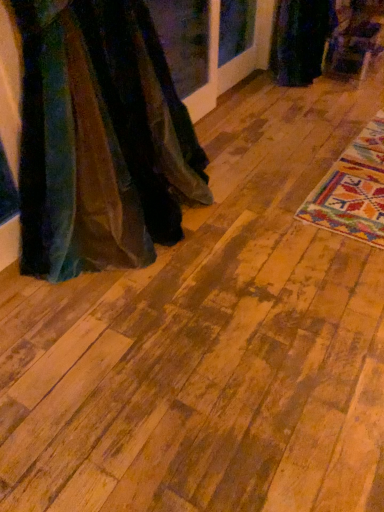
Question: Is velvet fabric dress at left, placed as the 1th fancy dress when sorted from left to right, placed right next to velvet dark green dress at upper right, the 1th fancy dress when ordered from right to left?

Choices:
 (A) yes
 (B) no

Answer: (B)

Question: From a real-world perspective, is velvet fabric dress at left, the first fancy dress viewed from the front, physically above velvet dark green dress at upper right, acting as the 2th fancy dress starting from the left?

Choices:
 (A) no
 (B) yes

Answer: (B)

Question: Does velvet fabric dress at left, the first fancy dress viewed from the front, appear on the right side of velvet dark green dress at upper right, acting as the 2th fancy dress starting from the left?

Choices:
 (A) yes
 (B) no

Answer: (B)

Question: Does velvet fabric dress at left, which appears as the 1th fancy dress when ordered from the bottom, have a greater width compared to velvet dark green dress at upper right, the 1th fancy dress when ordered from back to front?

Choices:
 (A) no
 (B) yes

Answer: (B)

Question: Can you confirm if velvet fabric dress at left, the second fancy dress when ordered from right to left, is positioned to the left of velvet dark green dress at upper right, the second fancy dress in the front-to-back sequence?

Choices:
 (A) no
 (B) yes

Answer: (B)

Question: Considering the relative sizes of velvet fabric dress at left, which is the 2th fancy dress in back-to-front order, and velvet dark green dress at upper right, the 1th fancy dress when ordered from back to front, in the image provided, is velvet fabric dress at left, which is the 2th fancy dress in back-to-front order, taller than velvet dark green dress at upper right, the 1th fancy dress when ordered from back to front,?

Choices:
 (A) yes
 (B) no

Answer: (A)

Question: Considering the relative sizes of velvet dark green dress at upper right, marked as the second fancy dress in a bottom-to-top arrangement, and wooden floor at center in the image provided, is velvet dark green dress at upper right, marked as the second fancy dress in a bottom-to-top arrangement, shorter than wooden floor at center?

Choices:
 (A) yes
 (B) no

Answer: (B)

Question: Does velvet dark green dress at upper right, the 1th fancy dress when ordered from back to front, have a greater width compared to wooden floor at center?

Choices:
 (A) no
 (B) yes

Answer: (A)

Question: Considering the relative sizes of velvet dark green dress at upper right, the 1th fancy dress when ordered from right to left, and wooden floor at center in the image provided, is velvet dark green dress at upper right, the 1th fancy dress when ordered from right to left, smaller than wooden floor at center?

Choices:
 (A) yes
 (B) no

Answer: (A)

Question: Would you consider velvet dark green dress at upper right, the 1th fancy dress when ordered from back to front, to be distant from wooden floor at center?

Choices:
 (A) yes
 (B) no

Answer: (A)

Question: From a real-world perspective, is velvet dark green dress at upper right, which ranks as the first fancy dress in top-to-bottom order, on top of wooden floor at center?

Choices:
 (A) no
 (B) yes

Answer: (B)

Question: Does velvet dark green dress at upper right, the second fancy dress in the front-to-back sequence, appear on the right side of wooden floor at center?

Choices:
 (A) yes
 (B) no

Answer: (B)

Question: Is wooden floor at center at the back of velvet fabric dress at left, the first fancy dress viewed from the front?

Choices:
 (A) no
 (B) yes

Answer: (A)